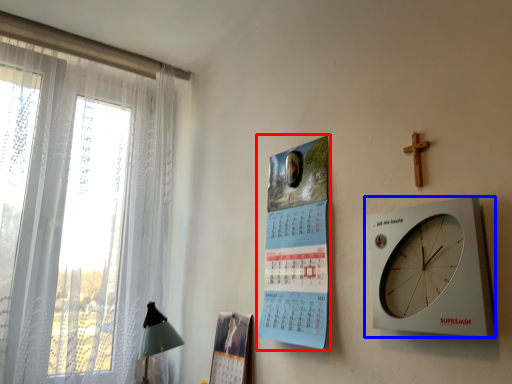
Question: Which object is closer to the camera taking this photo, poster page (highlighted by a red box) or wall clock (highlighted by a blue box)?

Choices:
 (A) poster page
 (B) wall clock

Answer: (B)